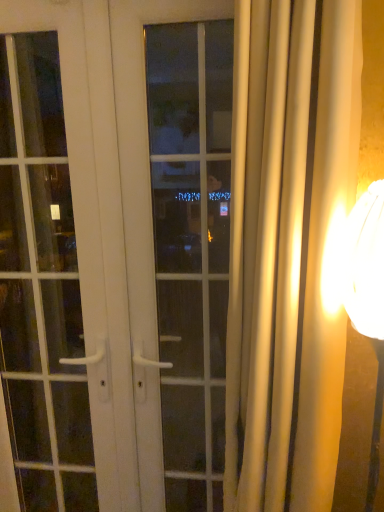
Find the location of a particular element. The height and width of the screenshot is (512, 384). silky beige curtain at right is located at coordinates [x=288, y=249].

Describe the element at coordinates (41, 286) in the screenshot. Image resolution: width=384 pixels, height=512 pixels. I see `white glossy door handle at left` at that location.

The height and width of the screenshot is (512, 384). What do you see at coordinates (109, 138) in the screenshot?
I see `white glossy door at center` at bounding box center [109, 138].

Identify the location of silky beige curtain at right. (288, 249).

Can you confirm if white glass window at center is shorter than white glossy door at center?

Yes.

Can you confirm if white glass window at center is bigger than white glossy door at center?

No, white glass window at center is not bigger than white glossy door at center.

Is white glass window at center oriented towards white glossy door at center?

Yes, white glass window at center is turned towards white glossy door at center.

From the image's perspective, is white glass window at center over white glossy door at center?

Actually, white glass window at center appears below white glossy door at center in the image.

From a real-world perspective, is silky beige curtain at right below white glossy door at center?

No.

Is point (309, 305) farther from viewer compared to point (30, 5)?

No, it is in front of (30, 5).

Would you say silky beige curtain at right is a long distance from white glossy door at center?

No, silky beige curtain at right is in close proximity to white glossy door at center.

From the image's perspective, which one is positioned lower, silky beige curtain at right or white glossy door at center?

From the image's view, silky beige curtain at right is below.

Can you confirm if matte gold lampshade at right is bigger than silky beige curtain at right?

No.

Do you think matte gold lampshade at right is within silky beige curtain at right, or outside of it?

matte gold lampshade at right is not enclosed by silky beige curtain at right.

Is matte gold lampshade at right thinner than silky beige curtain at right?

Indeed, matte gold lampshade at right has a lesser width compared to silky beige curtain at right.

Is matte gold lampshade at right far away from white glass window at center?

Yes, matte gold lampshade at right is far from white glass window at center.

Which is more to the left, matte gold lampshade at right or white glass window at center?

Positioned to the left is white glass window at center.

Considering the relative sizes of matte gold lampshade at right and white glass window at center in the image provided, is matte gold lampshade at right shorter than white glass window at center?

Indeed, matte gold lampshade at right has a lesser height compared to white glass window at center.

Which object is wider, silky beige curtain at right or matte gold lampshade at right?

With larger width is silky beige curtain at right.

How many degrees apart are the facing directions of silky beige curtain at right and matte gold lampshade at right?

51.5 degrees separate the facing orientations of silky beige curtain at right and matte gold lampshade at right.

Do you think silky beige curtain at right is within matte gold lampshade at right, or outside of it?

silky beige curtain at right cannot be found inside matte gold lampshade at right.

From the image's perspective, is silky beige curtain at right on top of matte gold lampshade at right?

Answer: Yes, from the image's perspective, silky beige curtain at right is on top of matte gold lampshade at right.

How distant is white glass window at center from white glossy door handle at left?

The distance of white glass window at center from white glossy door handle at left is 8.05 feet.

Between white glass window at center and white glossy door handle at left, which one appears on the right side from the viewer's perspective?

white glass window at center is more to the right.

From a real-world perspective, who is located lower, white glass window at center or white glossy door handle at left?

In real-world perspective, white glossy door handle at left is lower.

From the image's perspective, is white glass window at center above white glossy door handle at left?

Yes.

Are white glossy door at center and white glass window at center making contact?

No, white glossy door at center is not touching white glass window at center.

From the picture: From a real-world perspective, relative to white glass window at center, is white glossy door at center vertically above or below?

white glossy door at center is situated lower than white glass window at center in the real world.

Locate an element on the screen. window in front of the white glossy door at center is located at coordinates (191, 248).

You are a GUI agent. You are given a task and a screenshot of the screen. Output one action in this format:
    pyautogui.click(x=<x>, y=<y>)
    Task: Click on the window below the white glossy door at center (from the image's perspective)
    
    Given the screenshot: What is the action you would take?
    pyautogui.click(x=191, y=248)

Locate an element on the screen. This screenshot has width=384, height=512. curtain located in front of the white glossy door at center is located at coordinates (288, 249).

Looking at the image, which one is located closer to white glass window at center, silky beige curtain at right or white glossy door at center?

The object closer to white glass window at center is white glossy door at center.

Looking at this image, considering their positions, is white glass window at center positioned further to matte gold lampshade at right than silky beige curtain at right?

The object further to matte gold lampshade at right is white glass window at center.

Looking at the image, which one is located closer to silky beige curtain at right, matte gold lampshade at right or white glossy door at center?

Based on the image, matte gold lampshade at right appears to be nearer to silky beige curtain at right.

Which object lies nearer to the anchor point white glass window at center, white glossy door at center or white glossy door handle at left?

white glossy door handle at left.

From the image, which object appears to be farther from white glass window at center, matte gold lampshade at right or silky beige curtain at right?

matte gold lampshade at right.

Which object lies nearer to the anchor point white glass window at center, white glossy door at center or silky beige curtain at right?

Among the two, white glossy door at center is located nearer to white glass window at center.

Considering their positions, is matte gold lampshade at right positioned closer to white glass window at center than white glossy door at center?

white glossy door at center is closer to white glass window at center.

Looking at the image, which one is located closer to white glossy door handle at left, white glossy door at center or white glass window at center?

white glossy door at center is closer to white glossy door handle at left.

Where is `door situated between white glossy door handle at left and white glass window at center from left to right`? door situated between white glossy door handle at left and white glass window at center from left to right is located at coordinates (109, 138).

Where is `curtain between white glossy door at center and matte gold lampshade at right in the horizontal direction`? This screenshot has height=512, width=384. curtain between white glossy door at center and matte gold lampshade at right in the horizontal direction is located at coordinates (288, 249).

The image size is (384, 512). Find the location of `window between white glossy door at center and silky beige curtain at right`. window between white glossy door at center and silky beige curtain at right is located at coordinates (191, 248).

Identify the location of door situated between white glossy door handle at left and matte gold lampshade at right from left to right. (109, 138).